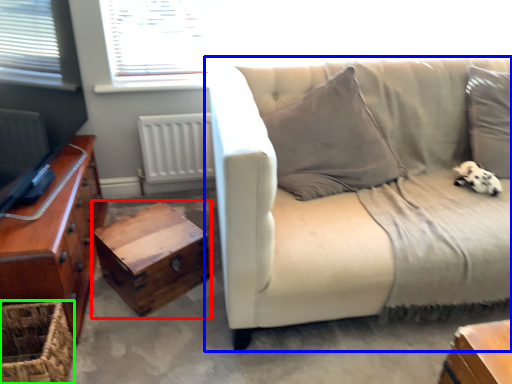
Question: Which object is positioned closest to table (highlighted by a red box)? Select from studio couch (highlighted by a blue box) and basket (highlighted by a green box).

Choices:
 (A) studio couch
 (B) basket

Answer: (B)